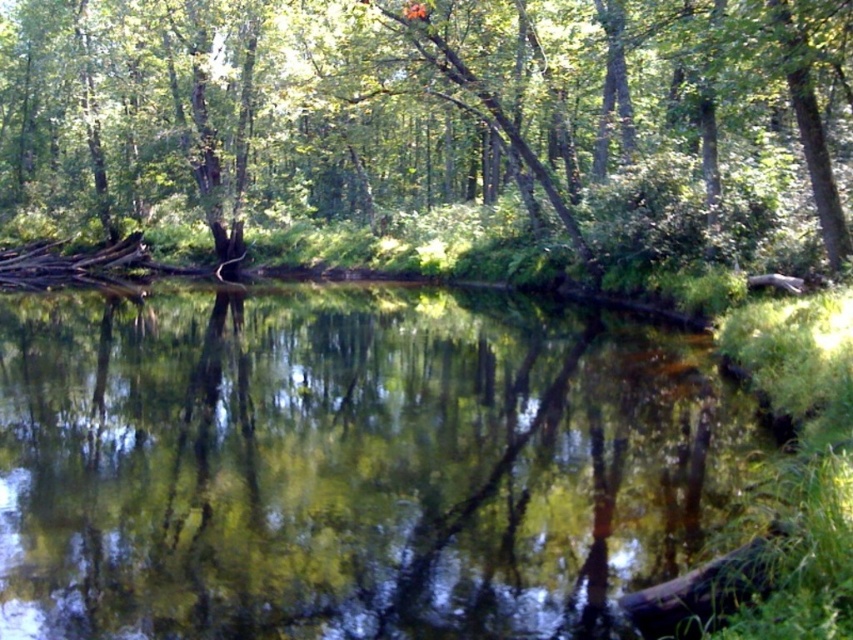
Does green reflective water at center appear under green leafy tree at center?

Correct, green reflective water at center is located below green leafy tree at center.

Can you confirm if green reflective water at center is positioned to the right of green leafy tree at center?

Indeed, green reflective water at center is positioned on the right side of green leafy tree at center.

Between point (572, 461) and point (524, 68), which one is positioned in front?

Positioned in front is point (572, 461).

Where is `green reflective water at center`? This screenshot has height=640, width=853. green reflective water at center is located at coordinates (350, 465).